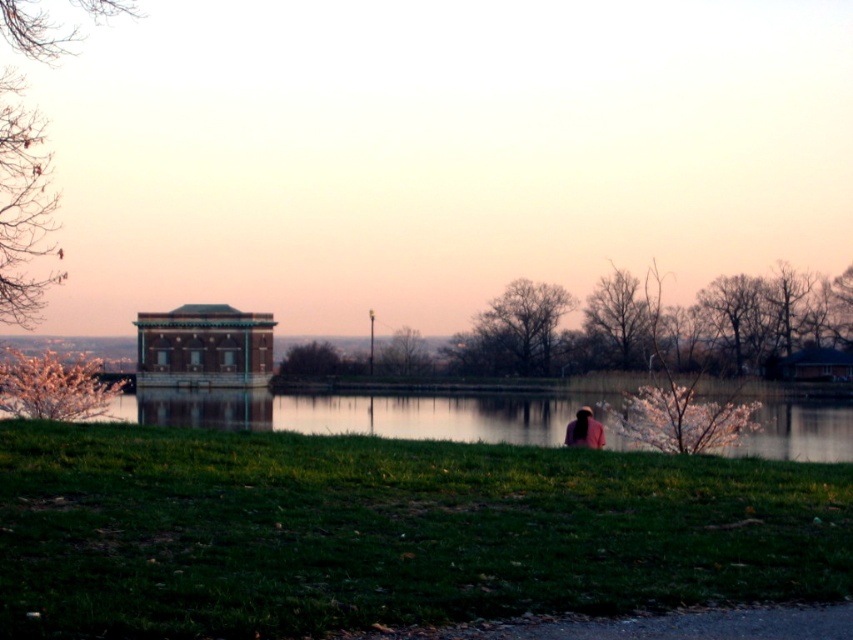
Question: Is green grass at lower center positioned in front of matte gray gazebo at center?

Choices:
 (A) no
 (B) yes

Answer: (B)

Question: Among these points, which one is farthest from the camera?

Choices:
 (A) (195, 394)
 (B) (223, 353)

Answer: (A)

Question: Does green grass at lower center have a larger size compared to matte gray gazebo at center?

Choices:
 (A) no
 (B) yes

Answer: (B)

Question: In this image, where is green grass at lower center located relative to matte gray gazebo at center?

Choices:
 (A) below
 (B) above

Answer: (A)